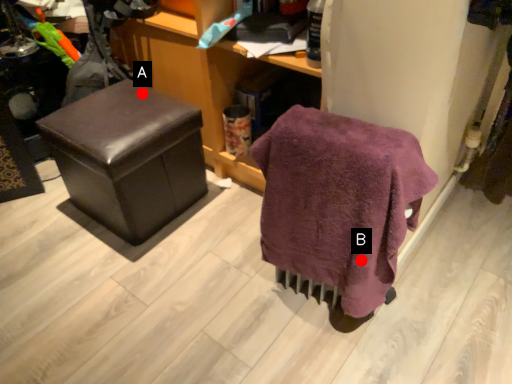
Question: Two points are circled on the image, labeled by A and B beside each circle. Which point is closer to the camera?

Choices:
 (A) A is closer
 (B) B is closer

Answer: (B)